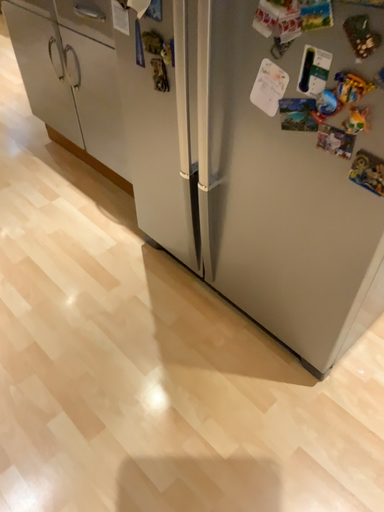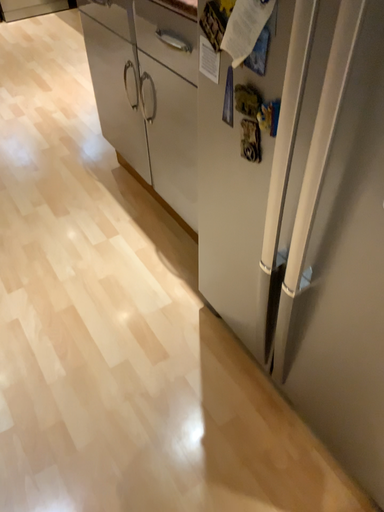
Question: How did the camera likely rotate when shooting the video?

Choices:
 (A) rotated right
 (B) rotated left

Answer: (B)